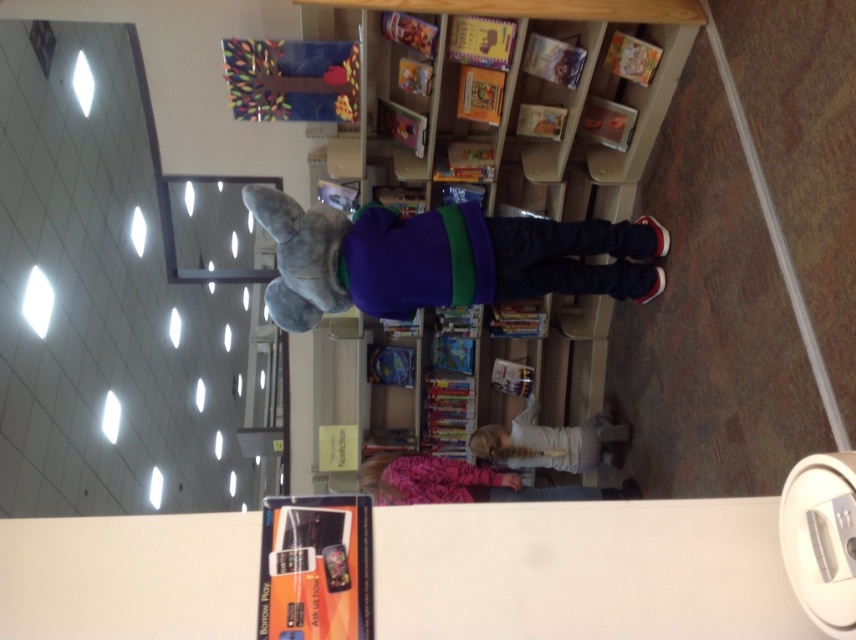
Question: Is plush gray elephant at center behind pink fleece jacket at lower center?

Choices:
 (A) yes
 (B) no

Answer: (B)

Question: Can you confirm if plush gray elephant at center is thinner than white matte shirt at center?

Choices:
 (A) no
 (B) yes

Answer: (A)

Question: Which of the following is the closest to the observer?

Choices:
 (A) pink fleece jacket at lower center
 (B) wooden bookcase at center
 (C) white matte shirt at center

Answer: (B)

Question: Is wooden bookcase at center bigger than plush gray elephant at center?

Choices:
 (A) yes
 (B) no

Answer: (A)

Question: Which of the following is the farthest from the observer?

Choices:
 (A) (494, 432)
 (B) (373, 308)
 (C) (366, 472)
 (D) (411, 96)

Answer: (A)

Question: Which object is positioned farthest from the plush gray elephant at center?

Choices:
 (A) wooden bookcase at center
 (B) white matte shirt at center

Answer: (B)